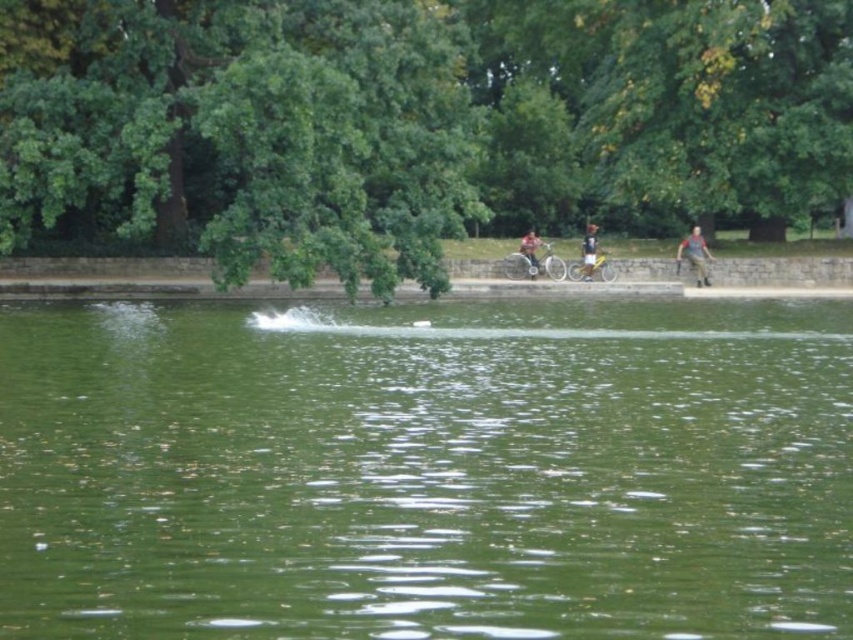
Question: Which object appears closest to the camera in this image?

Choices:
 (A) matte black bicycle at center
 (B) camouflage pants at right
 (C) dark blue shirt at center

Answer: (B)

Question: Does green leafy tree at upper center have a greater width compared to camouflage pants at right?

Choices:
 (A) yes
 (B) no

Answer: (A)

Question: Which object appears closest to the camera in this image?

Choices:
 (A) camouflage pants at right
 (B) dark blue shirt at center
 (C) green liquid water at center
 (D) green leafy tree at upper center

Answer: (C)

Question: Which of the following is the farthest from the observer?

Choices:
 (A) matte black bicycle at center
 (B) dark blue shirt at center
 (C) camouflage pants at right

Answer: (B)

Question: Is camouflage pants at right wider than dark blue shirt at center?

Choices:
 (A) no
 (B) yes

Answer: (B)

Question: Does green liquid water at center appear on the right side of matte black bicycle at center?

Choices:
 (A) yes
 (B) no

Answer: (B)